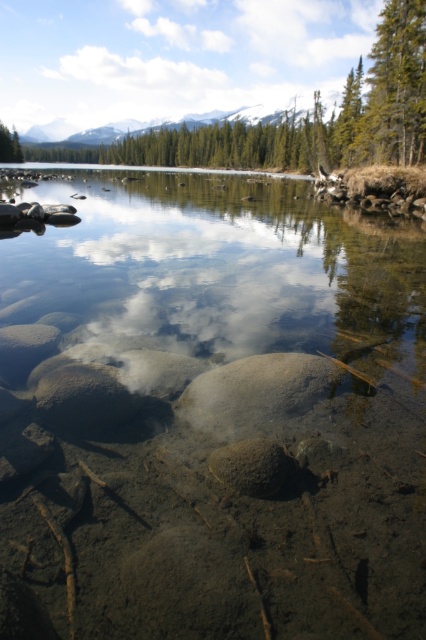
Question: Which point is closer to the camera?

Choices:
 (A) clear water at center
 (B) green textured tree at upper right

Answer: (A)

Question: Does clear water at center appear under green textured tree at upper right?

Choices:
 (A) yes
 (B) no

Answer: (A)

Question: Among these objects, which one is farthest from the camera?

Choices:
 (A) green textured tree at upper right
 (B) clear water at center

Answer: (A)

Question: Can you confirm if clear water at center is bigger than green textured tree at upper right?

Choices:
 (A) no
 (B) yes

Answer: (B)

Question: Which point is closer to the camera?

Choices:
 (A) (43, 280)
 (B) (402, 100)

Answer: (A)

Question: Does clear water at center appear under green textured tree at upper right?

Choices:
 (A) yes
 (B) no

Answer: (A)